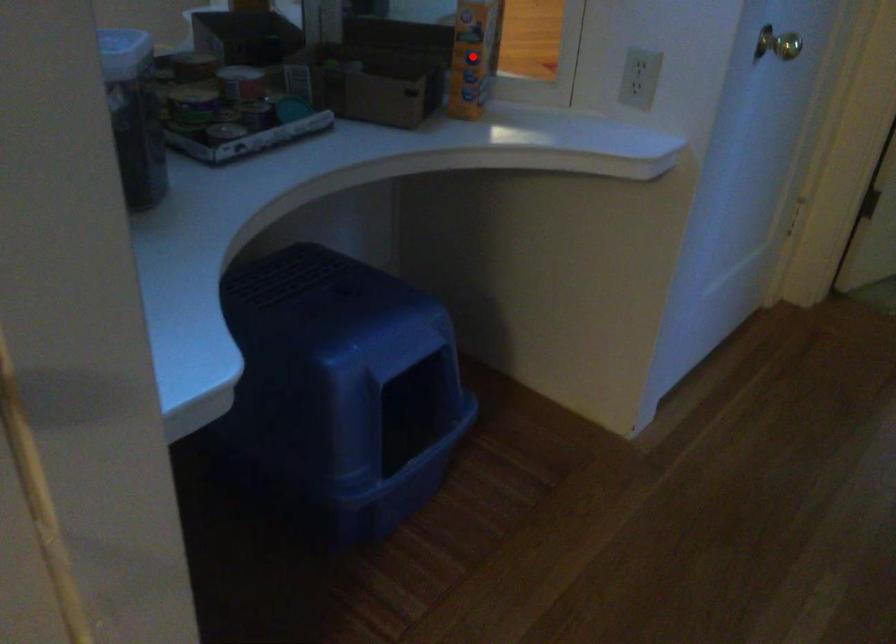
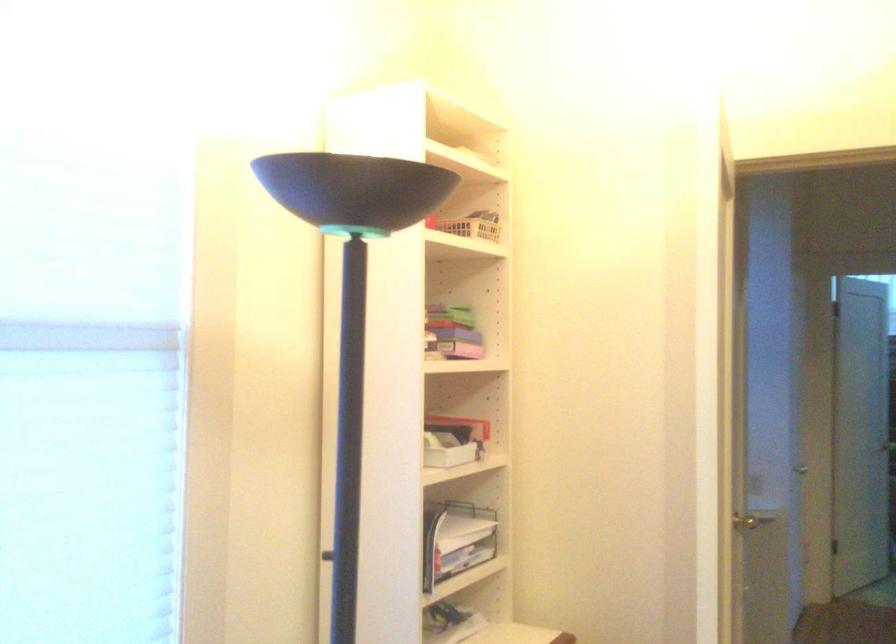
Question: I am providing you with two images of the same scene from different viewpoints. A red point is marked on the first image. At the location where the point appears in image 1, is it still visible in image 2?

Choices:
 (A) Yes
 (B) No

Answer: (B)